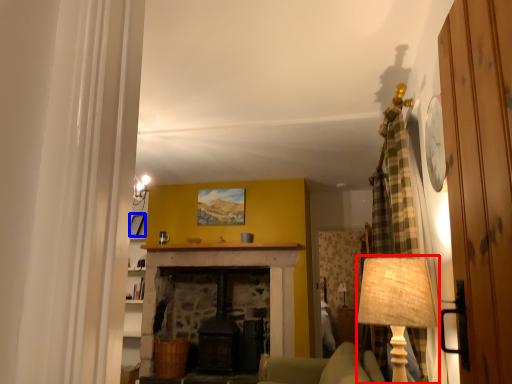
Question: Which object is further to the camera taking this photo, table lamp (highlighted by a red box) or picture frame (highlighted by a blue box)?

Choices:
 (A) table lamp
 (B) picture frame

Answer: (B)